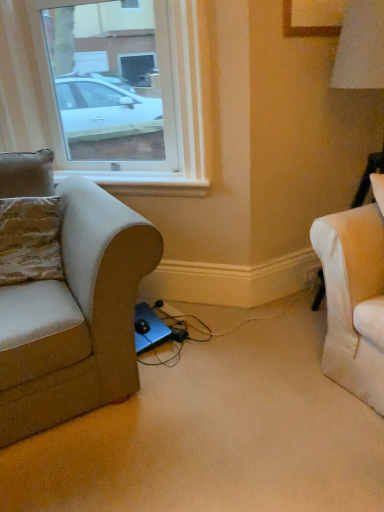
Question: Is black plastic electric outlet at lower right oriented away from transparent glass window at upper left?

Choices:
 (A) no
 (B) yes

Answer: (A)

Question: Does black plastic electric outlet at lower right appear on the right side of transparent glass window at upper left?

Choices:
 (A) yes
 (B) no

Answer: (A)

Question: From the image's perspective, does black plastic electric outlet at lower right appear lower than transparent glass window at upper left?

Choices:
 (A) no
 (B) yes

Answer: (B)

Question: From a real-world perspective, is black plastic electric outlet at lower right located beneath transparent glass window at upper left?

Choices:
 (A) yes
 (B) no

Answer: (A)

Question: Is black plastic electric outlet at lower right thinner than transparent glass window at upper left?

Choices:
 (A) no
 (B) yes

Answer: (B)

Question: Is black plastic electric outlet at lower right at the left side of transparent glass window at upper left?

Choices:
 (A) yes
 (B) no

Answer: (B)

Question: Does textured beige pillow at left lie behind transparent glass window at upper left?

Choices:
 (A) no
 (B) yes

Answer: (A)

Question: Does textured beige pillow at left appear on the left side of transparent glass window at upper left?

Choices:
 (A) no
 (B) yes

Answer: (B)

Question: Can you confirm if textured beige pillow at left is positioned to the right of transparent glass window at upper left?

Choices:
 (A) no
 (B) yes

Answer: (A)

Question: Is textured beige pillow at left not within transparent glass window at upper left?

Choices:
 (A) no
 (B) yes

Answer: (B)

Question: From a real-world perspective, is textured beige pillow at left over transparent glass window at upper left?

Choices:
 (A) no
 (B) yes

Answer: (A)

Question: From a real-world perspective, does textured beige pillow at left sit lower than transparent glass window at upper left?

Choices:
 (A) yes
 (B) no

Answer: (A)

Question: Does textured beige pillow at left lie behind matte beige couch at left?

Choices:
 (A) yes
 (B) no

Answer: (A)